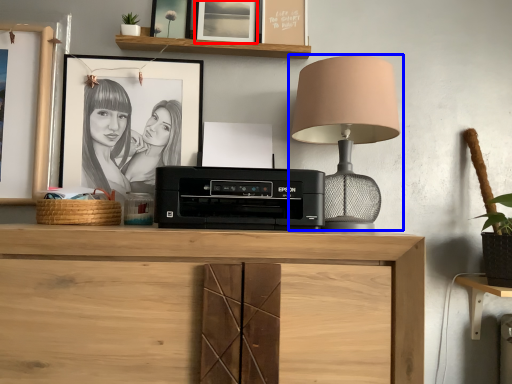
Question: Which object appears farthest to the camera in this image, picture frame (highlighted by a red box) or lamp (highlighted by a blue box)?

Choices:
 (A) picture frame
 (B) lamp

Answer: (A)